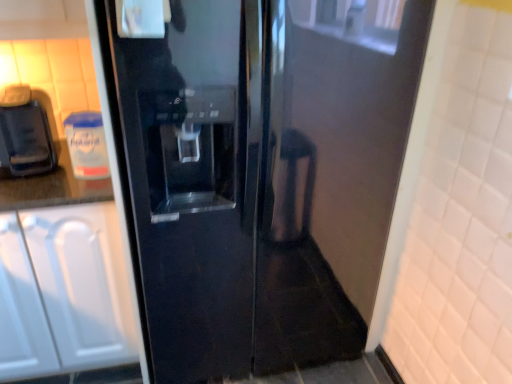
Question: From the image's perspective, is glossy black refrigerator at center located above matte black coffee machine at left?

Choices:
 (A) yes
 (B) no

Answer: (B)

Question: Considering the relative positions of glossy black refrigerator at center and matte black coffee machine at left in the image provided, is glossy black refrigerator at center behind matte black coffee machine at left?

Choices:
 (A) no
 (B) yes

Answer: (A)

Question: Considering the relative sizes of glossy black refrigerator at center and matte black coffee machine at left in the image provided, is glossy black refrigerator at center smaller than matte black coffee machine at left?

Choices:
 (A) no
 (B) yes

Answer: (A)

Question: Does glossy black refrigerator at center appear on the left side of matte black coffee machine at left?

Choices:
 (A) no
 (B) yes

Answer: (A)

Question: Is glossy black refrigerator at center thinner than matte black coffee machine at left?

Choices:
 (A) yes
 (B) no

Answer: (B)

Question: From a real-world perspective, is glossy black refrigerator at center over matte black coffee machine at left?

Choices:
 (A) yes
 (B) no

Answer: (B)

Question: From the image's perspective, is white matte cabinet at left below matte black coffee machine at left?

Choices:
 (A) yes
 (B) no

Answer: (A)

Question: From the image's perspective, is white matte cabinet at left on top of matte black coffee machine at left?

Choices:
 (A) yes
 (B) no

Answer: (B)

Question: Considering the relative sizes of white matte cabinet at left and matte black coffee machine at left in the image provided, is white matte cabinet at left wider than matte black coffee machine at left?

Choices:
 (A) yes
 (B) no

Answer: (A)

Question: Is white matte cabinet at left to the right of matte black coffee machine at left from the viewer's perspective?

Choices:
 (A) yes
 (B) no

Answer: (B)

Question: Can you confirm if white matte cabinet at left is thinner than matte black coffee machine at left?

Choices:
 (A) yes
 (B) no

Answer: (B)

Question: Is white matte cabinet at left facing towards matte black coffee machine at left?

Choices:
 (A) yes
 (B) no

Answer: (B)

Question: Does matte black coffee machine at left have a larger size compared to white matte cabinet at left?

Choices:
 (A) no
 (B) yes

Answer: (A)